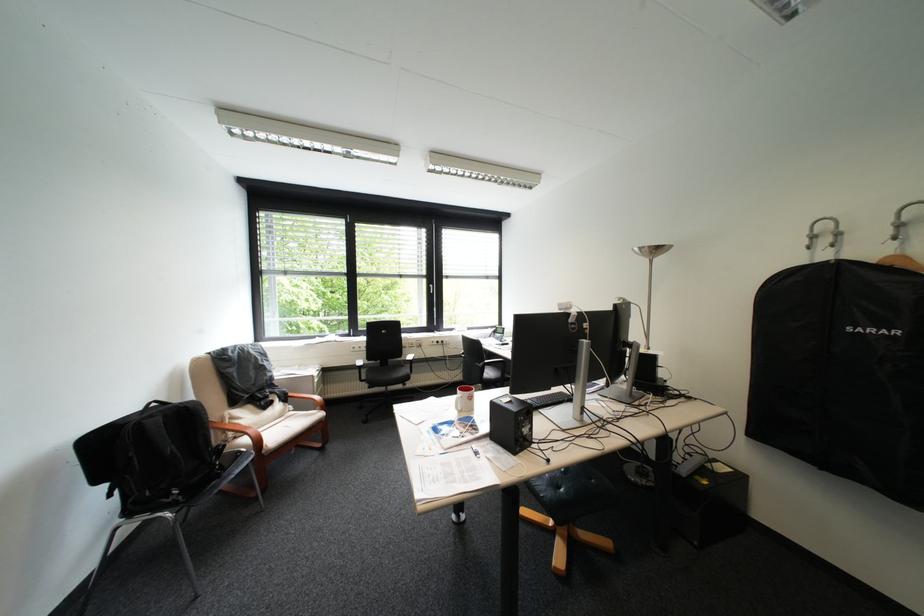
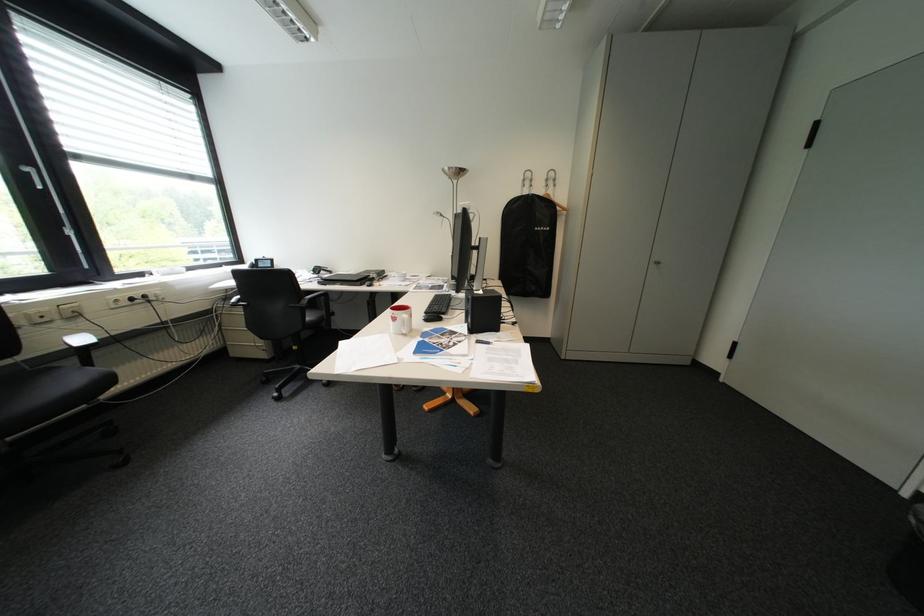
The point at [444,286] is marked in the first image. Where is the corresponding point in the second image?

(41, 169)